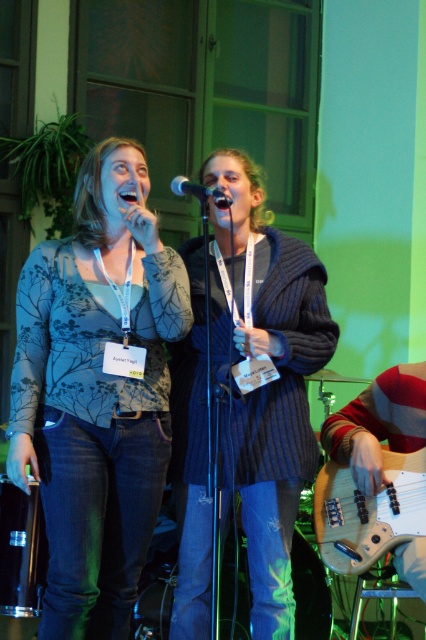
Can you confirm if matte floral top at center is bigger than metallic silver microphone at center?

Yes.

Does matte floral top at center appear on the right side of metallic silver microphone at center?

In fact, matte floral top at center is to the left of metallic silver microphone at center.

Which is behind, point (75, 500) or point (219, 193)?

The point (219, 193) is more distant.

Identify the location of matte floral top at center. Image resolution: width=426 pixels, height=640 pixels. (97, 392).

Which is above, knitted dark blue sweater at center or metallic silver microphone at center?

metallic silver microphone at center is higher up.

Is point (236, 454) closer to viewer compared to point (196, 193)?

No, it is behind (196, 193).

Is point (302, 468) behind point (195, 188)?

Yes.

This screenshot has height=640, width=426. I want to click on knitted dark blue sweater at center, so click(270, 381).

Is light brown wood guitar at lower right to the left of metallic silver microphone at center from the viewer's perspective?

Incorrect, light brown wood guitar at lower right is not on the left side of metallic silver microphone at center.

Does light brown wood guitar at lower right have a larger size compared to metallic silver microphone at center?

Correct, light brown wood guitar at lower right is larger in size than metallic silver microphone at center.

Does point (354, 497) lie behind point (226, 198)?

Yes, point (354, 497) is behind point (226, 198).

What are the coordinates of `light brown wood guitar at lower right` in the screenshot? It's located at (368, 513).